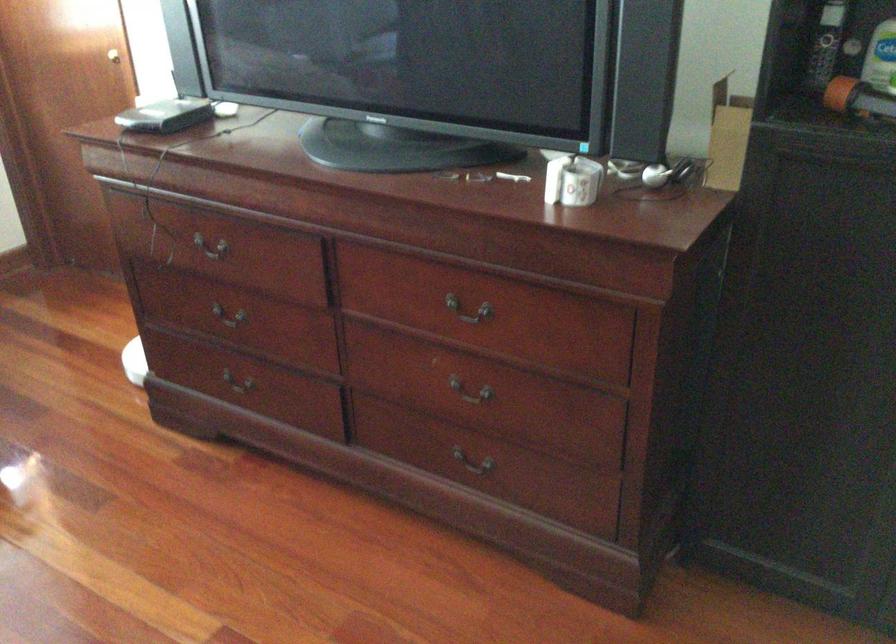
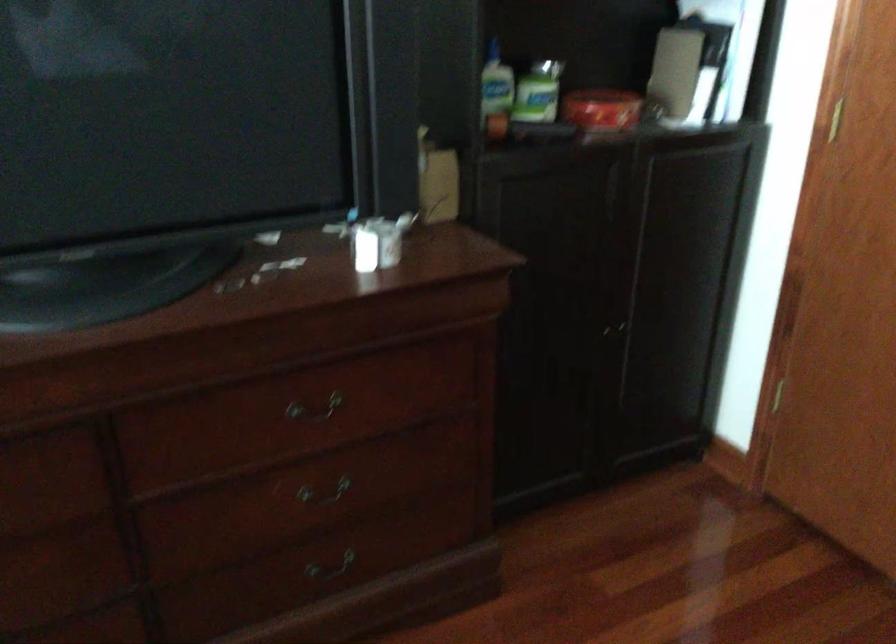
Find the pixel in the second image that matches (x=581, y=182) in the first image.

(378, 242)